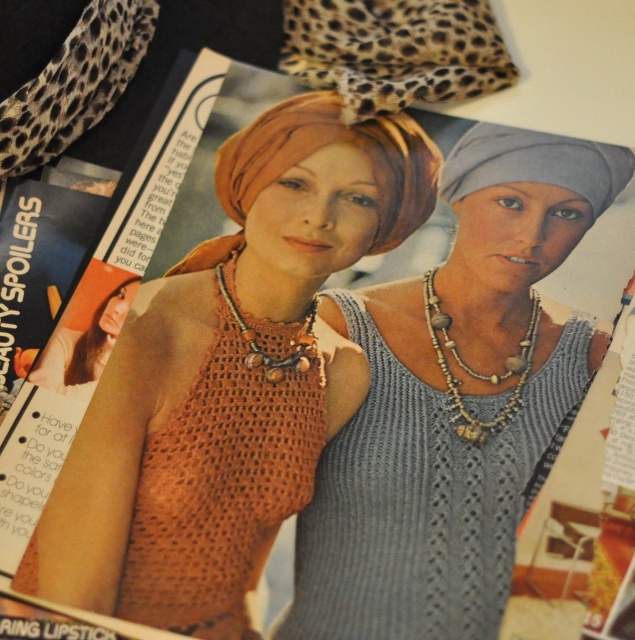
Does knitted orange tank top at center have a smaller size compared to brown wooden beads necklace at center?

No.

Can you confirm if knitted orange tank top at center is taller than brown wooden beads necklace at center?

Correct, knitted orange tank top at center is much taller as brown wooden beads necklace at center.

Does point (472, 509) come farther from viewer compared to point (276, 378)?

No, it is not.

Identify the location of knitted orange tank top at center. (455, 401).

Does crochet tank top at center have a lesser width compared to knitted orange tank top at center?

No, crochet tank top at center is not thinner than knitted orange tank top at center.

Is point (222, 323) positioned before point (410, 618)?

No, (222, 323) is behind (410, 618).

This screenshot has width=635, height=640. I want to click on crochet tank top at center, so click(x=229, y=378).

Is crochet tank top at center smaller than wooden beads necklace at center?

No.

Between point (244, 634) and point (531, 353), which one is positioned in front?

Point (244, 634)

What are the coordinates of `crochet tank top at center` in the screenshot? It's located at (229, 378).